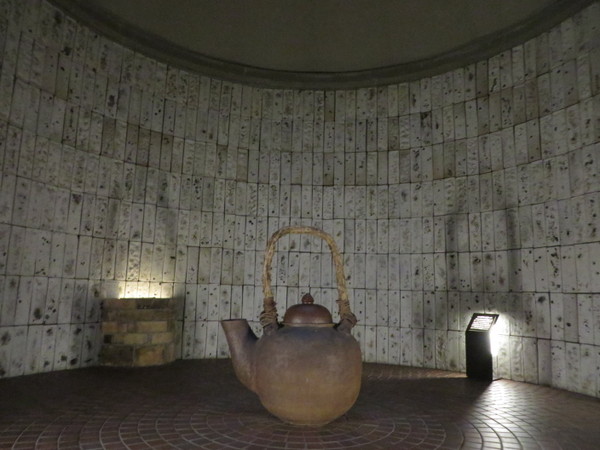
Find the location of a particular element. This screenshot has height=450, width=600. walls bricked multiple is located at coordinates (76, 203), (301, 190), (548, 174).